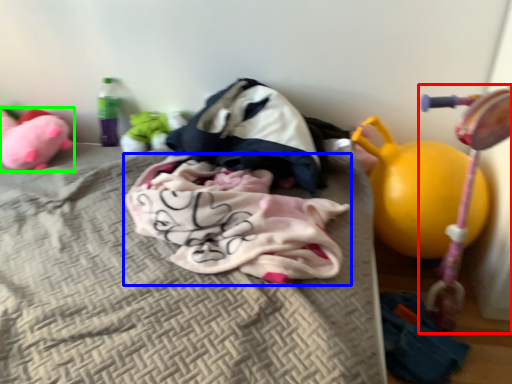
Question: Which object is the farthest from baby carriage (highlighted by a red box)? Choose among these: baby clothe (highlighted by a blue box) or toy (highlighted by a green box).

Choices:
 (A) baby clothe
 (B) toy

Answer: (B)